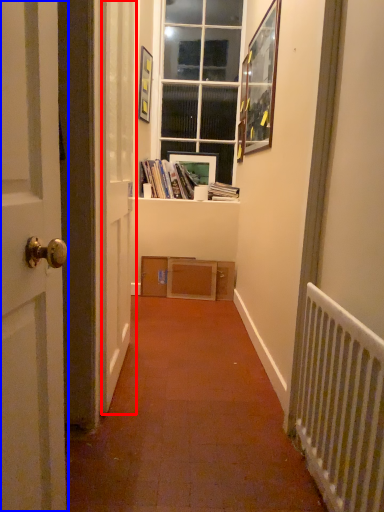
Question: Which of the following is the farthest to the observer, screen door (highlighted by a red box) or door (highlighted by a blue box)?

Choices:
 (A) screen door
 (B) door

Answer: (A)